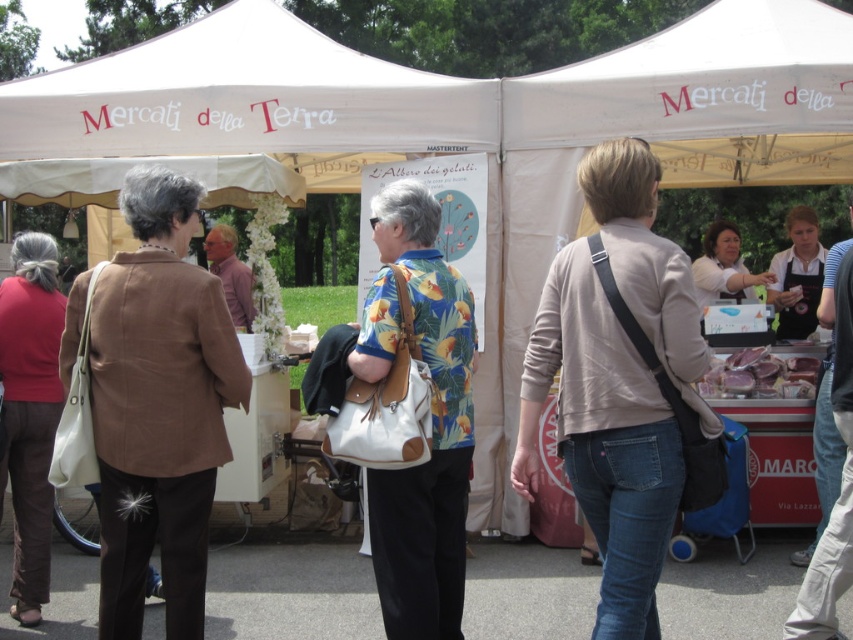
Which is above, light brown leather jacket at center or black apron at right?

black apron at right is above.

Describe the element at coordinates (618, 381) in the screenshot. The width and height of the screenshot is (853, 640). I see `light brown leather jacket at center` at that location.

Which is behind, point (621, 157) or point (813, 257)?

The point (813, 257) is behind.

Where is `light brown leather jacket at center`? The image size is (853, 640). light brown leather jacket at center is located at coordinates (618, 381).

Does brown leather jacket at left appear on the left side of black apron at right?

Yes, brown leather jacket at left is to the left of black apron at right.

Describe the element at coordinates (160, 406) in the screenshot. I see `brown leather jacket at left` at that location.

At what (x,y) coordinates should I click in order to perform the action: click on brown leather jacket at left. Please return your answer as a coordinate pair (x, y). The image size is (853, 640). Looking at the image, I should click on (160, 406).

Does point (819, 260) come farther from viewer compared to point (757, 376)?

Yes, point (819, 260) is behind point (757, 376).

Can you confirm if black apron at right is thinner than raw pink meat at center?

Indeed, black apron at right has a lesser width compared to raw pink meat at center.

Does point (767, 289) come farther from viewer compared to point (776, 378)?

That is True.

Where is `black apron at right`? Image resolution: width=853 pixels, height=640 pixels. black apron at right is located at coordinates (798, 275).